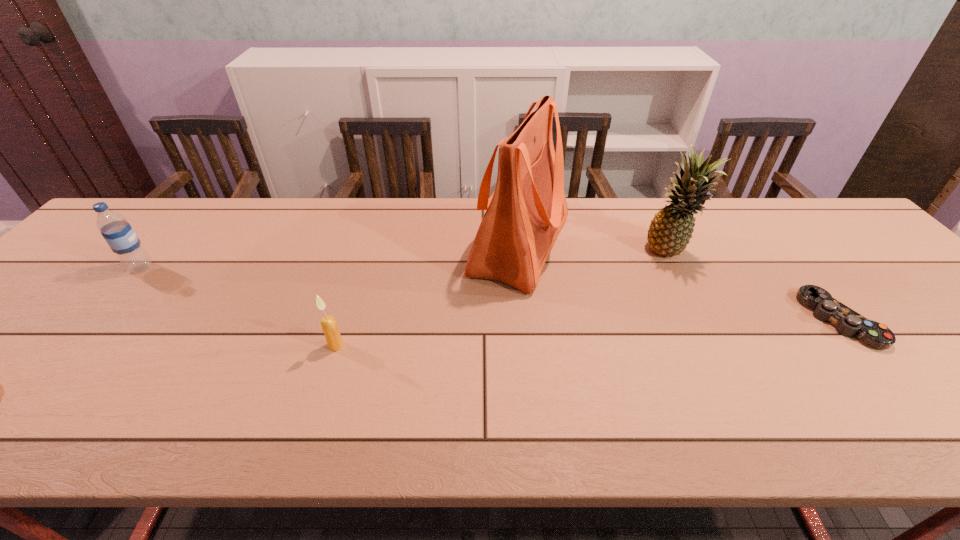
Locate an element on the screen. This screenshot has width=960, height=540. object that is the third closest to the candle is located at coordinates click(x=671, y=229).

Identify the location of vacant space that satisfies the following two spatial constraints: 1. on the front side of the tallest object; 2. on the left side of the fourth shortest object. (521, 253).